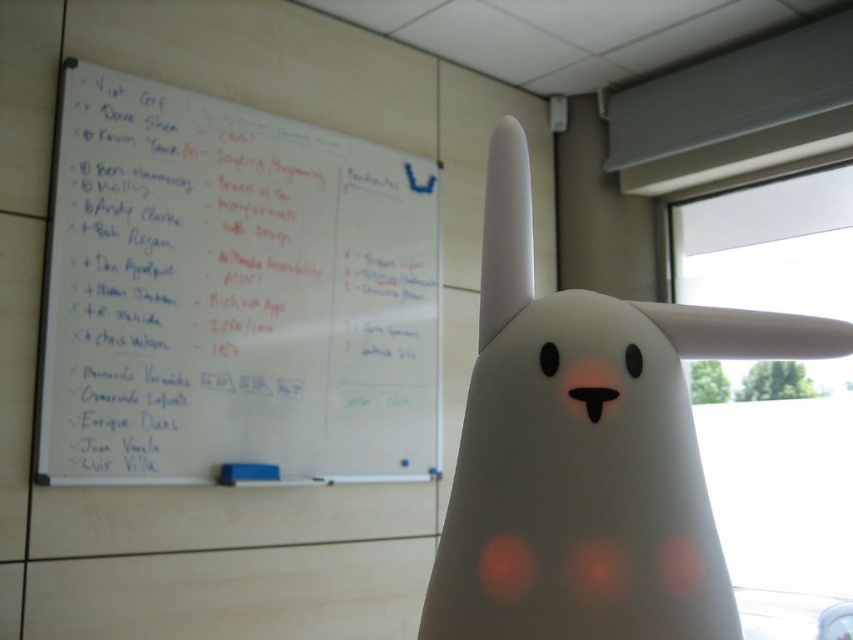
You are organizing a meeting in the room and need to place a 15 inch wide notebook between the white matte whiteboard at upper left and the white matte eraser at center. Is there enough space to fit the notebook between them?

The white matte whiteboard at upper left and white matte eraser at center are 18.23 inches apart, so yes, the 15 inch wide notebook can fit between them since 15 inches is less than 18.23 inches.

You are standing at the camera position and want to place a small sticker exactly at point (397, 397) on the whiteboard. If the whiteboard is 1.8 meters away from you, will you be able to reach the point with your hand?

The distance between point (397, 397) and the camera is 2.04 meters, which is further than the 1.8 meters you mentioned. Therefore, you cannot reach the point with your hand.

You are standing in a meeting room and need to locate the whiteboard. According to the image, where is the white matte whiteboard at upper left located?

The white matte whiteboard at upper left is located at point (233, 294).